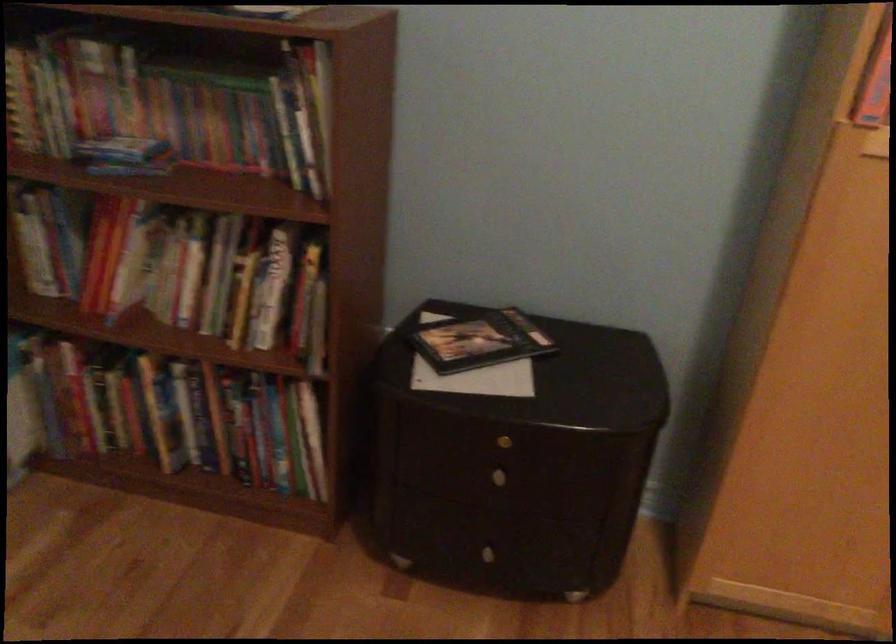
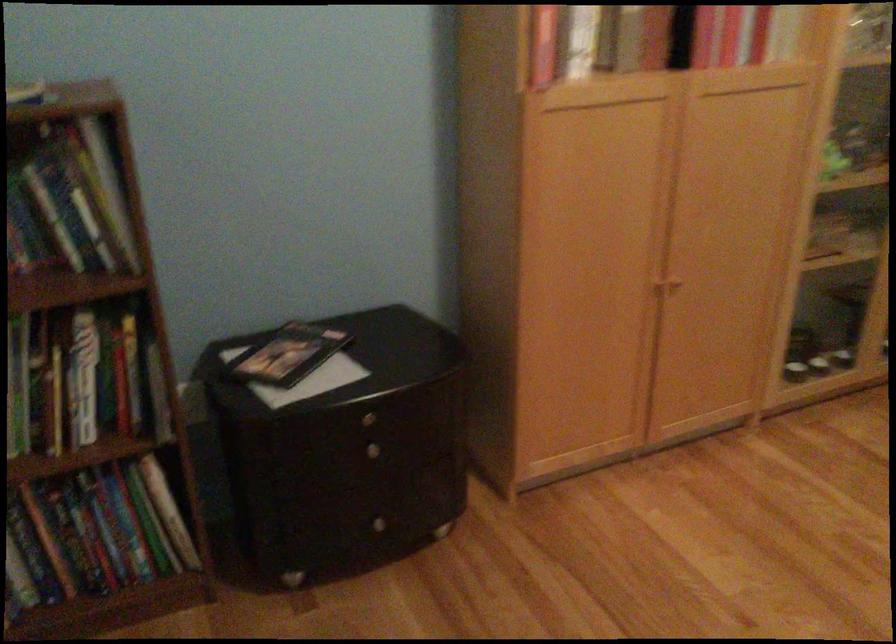
Find the pixel in the second image that matches pixel 503 484 in the first image.

(376, 457)